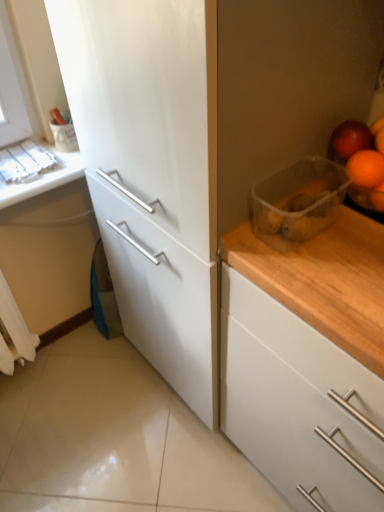
The height and width of the screenshot is (512, 384). In order to click on free point above white matte counter top at upper left (from a real-world perspective) in this screenshot , I will do `click(23, 158)`.